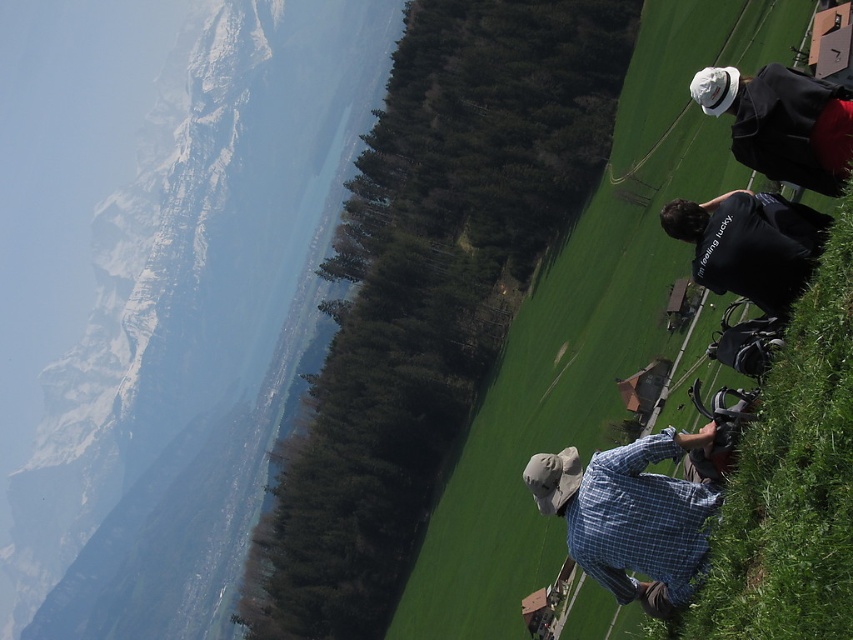
Question: Is white matte hat at upper right positioned behind black cotton shirt at center right?

Choices:
 (A) no
 (B) yes

Answer: (B)

Question: Among these points, which one is farthest from the camera?

Choices:
 (A) (637, 193)
 (B) (689, 577)

Answer: (A)

Question: Among these points, which one is nearest to the camera?

Choices:
 (A) (701, 257)
 (B) (560, 388)
 (C) (776, 109)
 (D) (688, 528)

Answer: (D)

Question: Which object is positioned farthest from the green grass at right?

Choices:
 (A) blue plaid shirt at lower right
 (B) black cotton shirt at center right
 (C) white matte hat at upper right

Answer: (C)

Question: From the image, what is the correct spatial relationship of green grass at right in relation to black cotton shirt at center right?

Choices:
 (A) right
 (B) left

Answer: (A)

Question: Is the position of blue plaid shirt at lower right more distant than that of white matte hat at upper right?

Choices:
 (A) no
 (B) yes

Answer: (A)